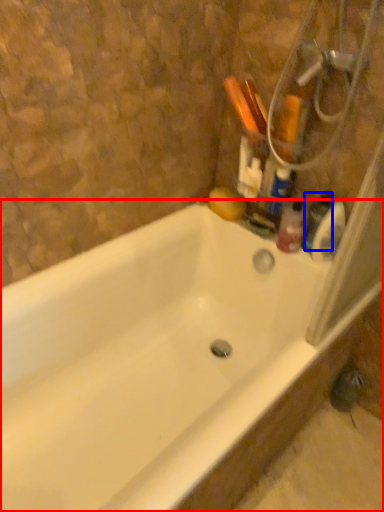
Question: Which object appears farthest to the camera in this image, bathtub (highlighted by a red box) or toiletry (highlighted by a blue box)?

Choices:
 (A) bathtub
 (B) toiletry

Answer: (B)